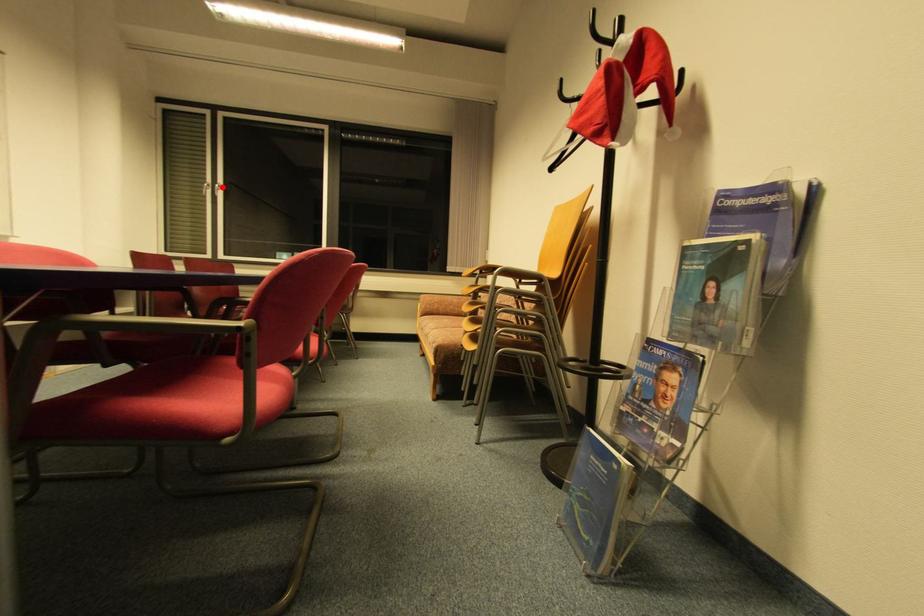
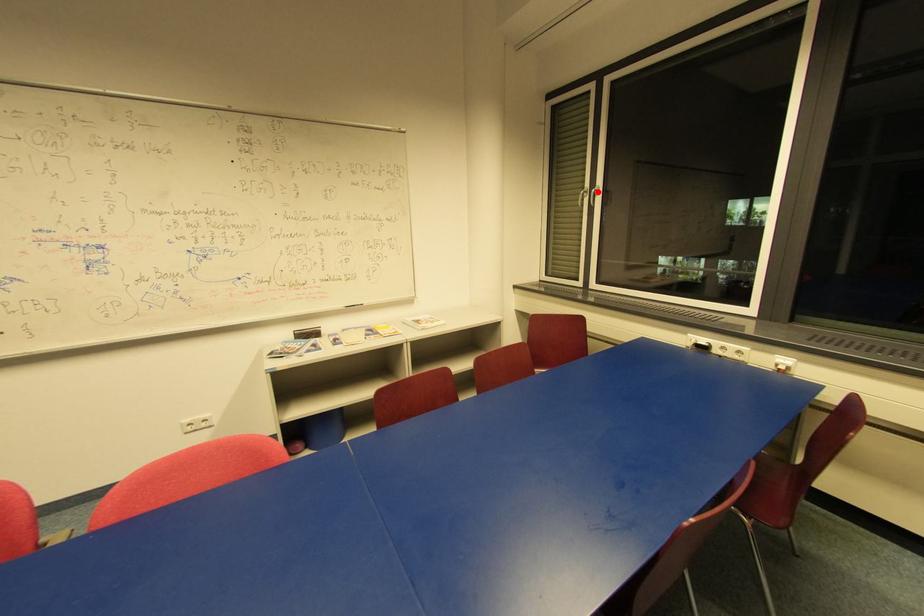
I am providing you with two images of the same scene from different viewpoints. A red point is marked on the first image and another point is marked on the second image. Does the point marked in image1 correspond to the same location as the one in image2?

Yes